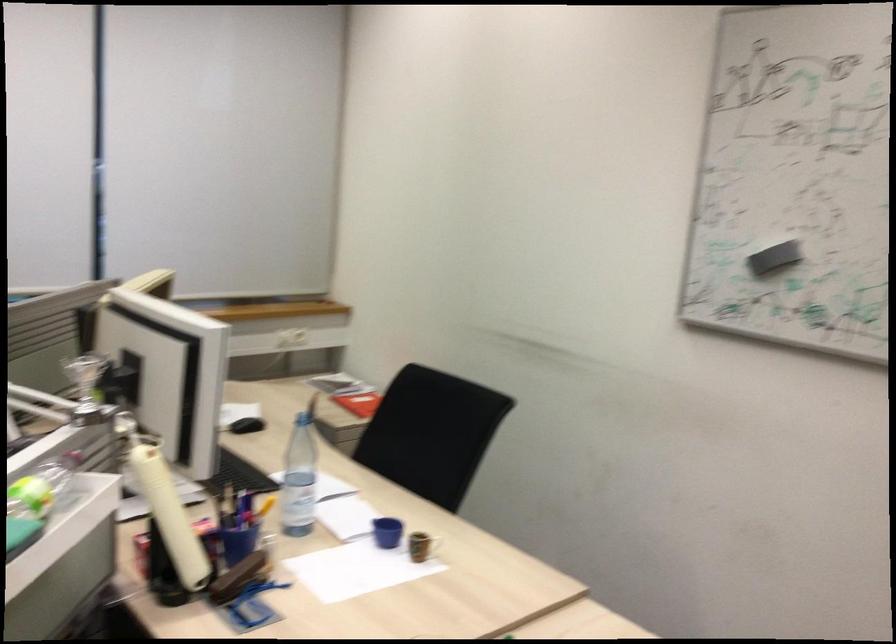
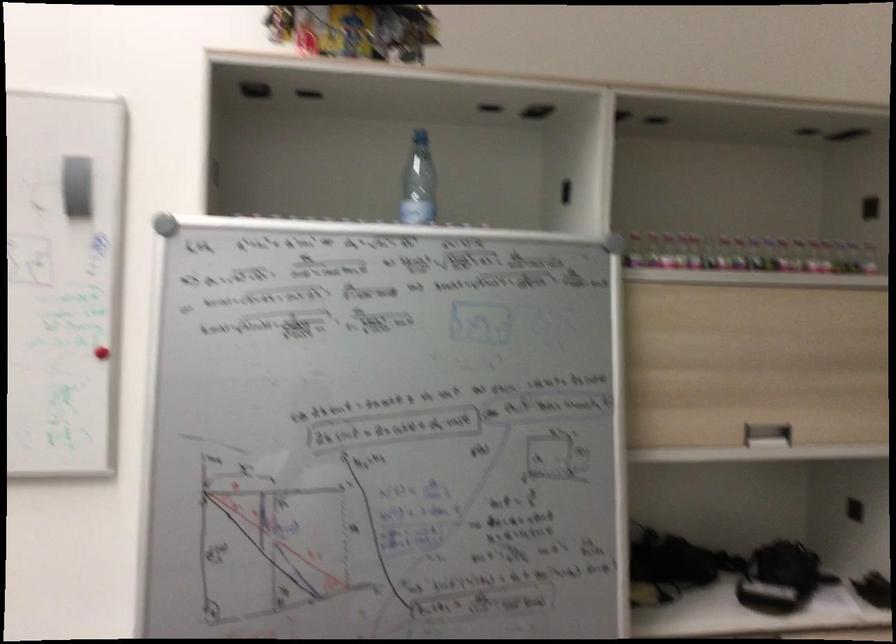
Question: The camera is either moving clockwise (left) or counter-clockwise (right) around the object. The first image is from the beginning of the video and the second image is from the end. Is the camera moving left or right when shooting the video?

Choices:
 (A) Left
 (B) Right

Answer: (A)